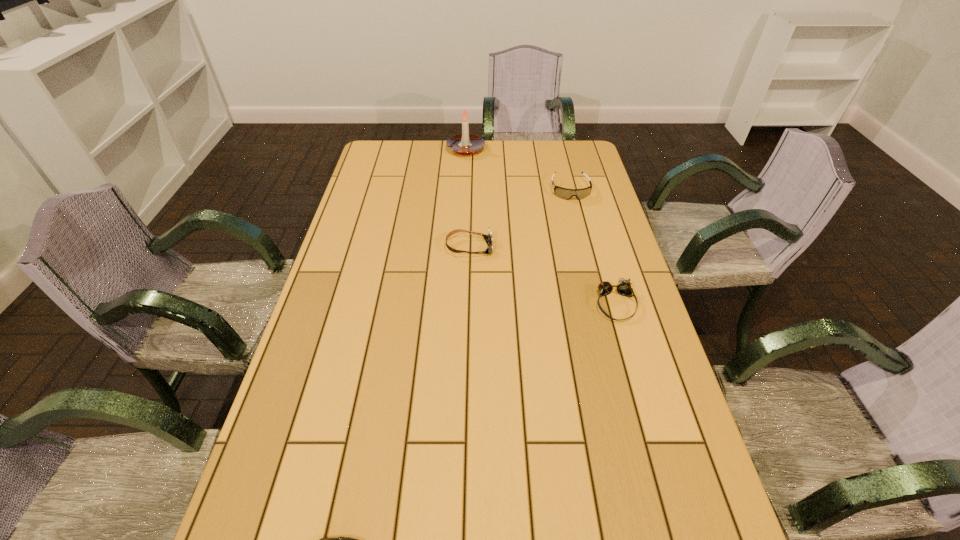
Locate an element on the screen. The height and width of the screenshot is (540, 960). free space between the farthest goggles and the second nearest goggles is located at coordinates (519, 219).

Locate an element on the screen. The height and width of the screenshot is (540, 960). object that is the third closest to the leftmost goggles is located at coordinates (465, 144).

Locate which object is the third closest to the leftmost goggles. Please provide its 2D coordinates. Your answer should be formatted as a tuple, i.e. [(x, y)], where the tuple contains the x and y coordinates of a point satisfying the conditions above.

[(465, 144)]

Select which goggles appears as the second closest to the farthest object. Please provide its 2D coordinates. Your answer should be formatted as a tuple, i.e. [(x, y)], where the tuple contains the x and y coordinates of a point satisfying the conditions above.

[(488, 238)]

You are a GUI agent. You are given a task and a screenshot of the screen. Output one action in this format:
    pyautogui.click(x=<x>, y=<y>)
    Task: Click on the goggles identified as the second closest to the third farthest object
    
    Given the screenshot: What is the action you would take?
    pyautogui.click(x=623, y=287)

Where is `vacant region that satisfies the following two spatial constraints: 1. on the front and sides of the farthest goggles; 2. on the front-facing side of the leftmost goggles`? vacant region that satisfies the following two spatial constraints: 1. on the front and sides of the farthest goggles; 2. on the front-facing side of the leftmost goggles is located at coordinates (585, 247).